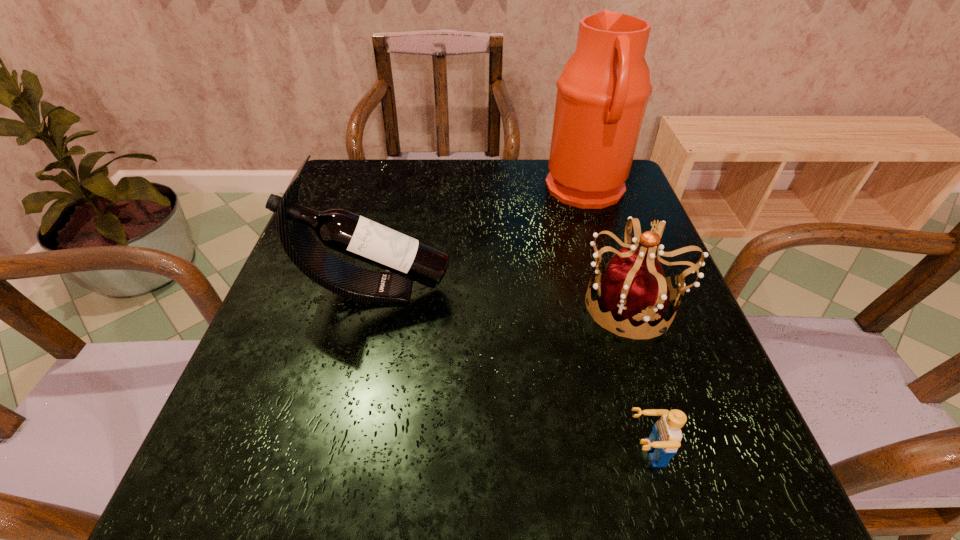
The image size is (960, 540). Find the location of `the tallest object`. the tallest object is located at coordinates (603, 91).

This screenshot has height=540, width=960. Identify the location of the farthest object. (603, 91).

Identify the location of the leftmost object. This screenshot has width=960, height=540. (408, 259).

The width and height of the screenshot is (960, 540). Find the location of `the second tallest object`. the second tallest object is located at coordinates (408, 259).

At what (x,y) coordinates should I click in order to perform the action: click on tiara. Please return your answer as a coordinate pair (x, y). Looking at the image, I should click on (634, 290).

Find the location of `the nearest object`. the nearest object is located at coordinates (664, 440).

Where is `Lego`? Lego is located at coordinates (664, 440).

At what (x,y) coordinates should I click in order to perform the action: click on free region located from the spout of the tallest object. Please return your answer as a coordinate pair (x, y). The image size is (960, 540). Looking at the image, I should click on (419, 191).

This screenshot has width=960, height=540. I want to click on free space located 0.090m from the spout of the tallest object, so click(x=513, y=191).

Where is `vacant space located 0.160m from the spout of the tallest object`? This screenshot has height=540, width=960. vacant space located 0.160m from the spout of the tallest object is located at coordinates (486, 191).